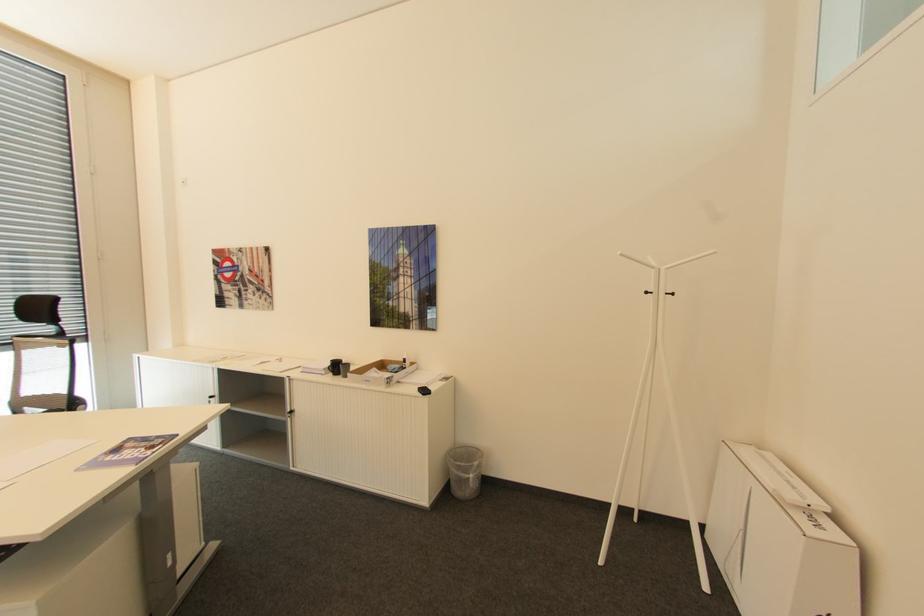
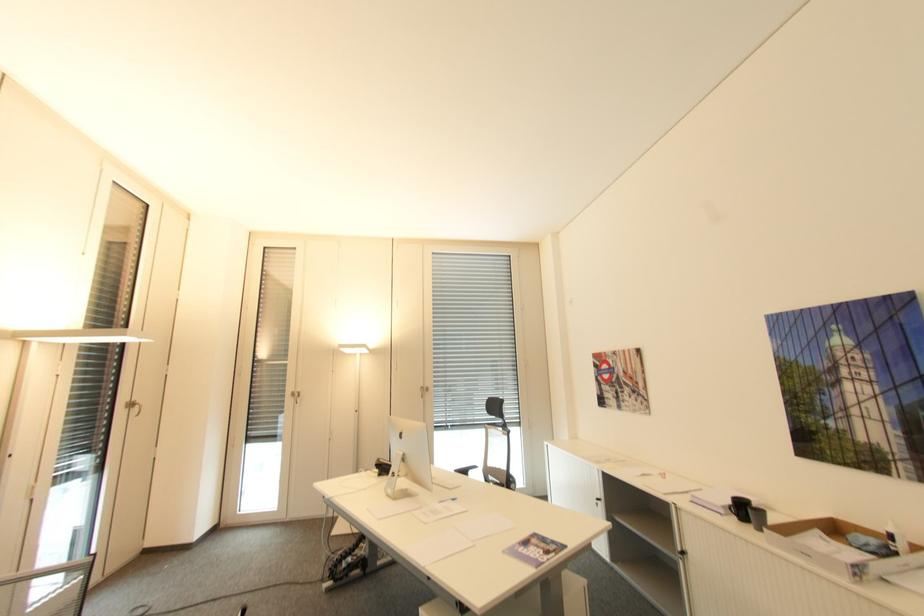
The point at (408, 360) is marked in the first image. Where is the corresponding point in the second image?

(895, 537)